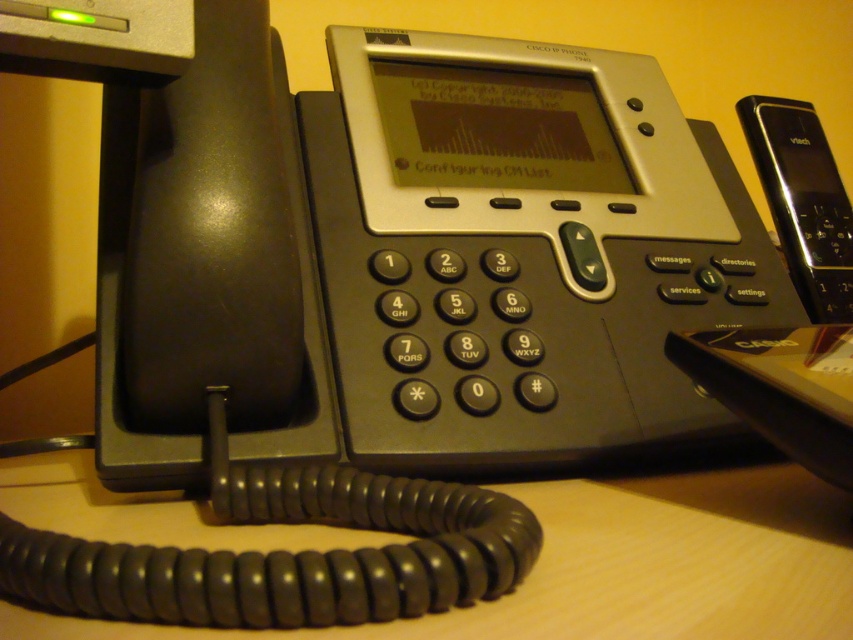
Question: Does wooden table at center have a smaller size compared to black plastic phone at right?

Choices:
 (A) no
 (B) yes

Answer: (A)

Question: Does wooden table at center appear on the right side of black plastic phone at right?

Choices:
 (A) no
 (B) yes

Answer: (A)

Question: Which object appears farthest from the camera in this image?

Choices:
 (A) wooden table at center
 (B) black plastic phone at right

Answer: (B)

Question: Does wooden table at center appear under black plastic phone at right?

Choices:
 (A) yes
 (B) no

Answer: (A)

Question: Among these objects, which one is farthest from the camera?

Choices:
 (A) wooden table at center
 (B) black plastic phone at right

Answer: (B)

Question: Which point is closer to the camera?

Choices:
 (A) (819, 524)
 (B) (817, 166)

Answer: (A)